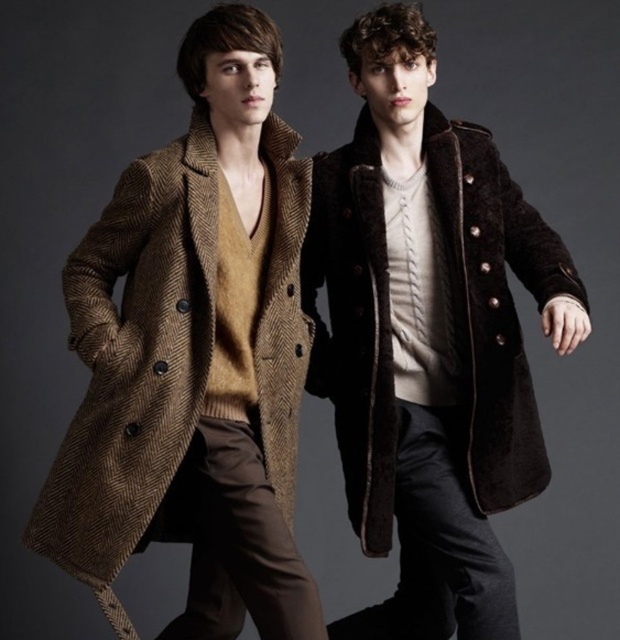
Which is below, herringbone wool coat at left or brown woolen coat at center?

herringbone wool coat at left

Does herringbone wool coat at left have a lesser height compared to brown woolen coat at center?

Yes.

Between point (293, 436) and point (388, 275), which one is positioned in front?

Point (388, 275) is more forward.

This screenshot has width=620, height=640. I want to click on herringbone wool coat at left, so click(x=135, y=362).